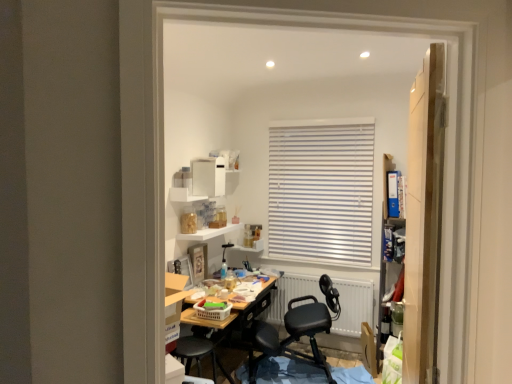
Question: Is white matte radiator at center located outside white matte shelf at upper center, which is counted as the 2th shelf, starting from the top?

Choices:
 (A) yes
 (B) no

Answer: (A)

Question: Is white matte shelf at upper center, marked as the 1th shelf in a bottom-to-top arrangement, a part of white matte radiator at center?

Choices:
 (A) no
 (B) yes

Answer: (A)

Question: Is white matte shelf at upper center, marked as the 1th shelf in a bottom-to-top arrangement, at the back of white matte radiator at center?

Choices:
 (A) yes
 (B) no

Answer: (B)

Question: Can you confirm if white matte radiator at center is smaller than white matte shelf at upper center, which is counted as the 2th shelf, starting from the top?

Choices:
 (A) yes
 (B) no

Answer: (B)

Question: From the image's perspective, would you say white matte radiator at center is positioned over white matte shelf at upper center, which is counted as the 2th shelf, starting from the top?

Choices:
 (A) yes
 (B) no

Answer: (B)

Question: Can you confirm if white matte radiator at center is thinner than white matte shelf at upper center, which is counted as the 2th shelf, starting from the top?

Choices:
 (A) no
 (B) yes

Answer: (B)

Question: Is white glossy shelf at upper center, acting as the second shelf starting from the bottom, smaller than wooden door at right?

Choices:
 (A) no
 (B) yes

Answer: (B)

Question: Is white glossy shelf at upper center, the first shelf positioned from the top, thinner than wooden door at right?

Choices:
 (A) no
 (B) yes

Answer: (B)

Question: Is wooden door at right inside white glossy shelf at upper center, acting as the second shelf starting from the bottom?

Choices:
 (A) yes
 (B) no

Answer: (B)

Question: Is white glossy shelf at upper center, the first shelf positioned from the top, touching wooden door at right?

Choices:
 (A) no
 (B) yes

Answer: (A)

Question: From a real-world perspective, is white glossy shelf at upper center, the first shelf positioned from the top, under wooden door at right?

Choices:
 (A) yes
 (B) no

Answer: (B)

Question: Considering the relative sizes of white glossy shelf at upper center, the first shelf positioned from the top, and wooden door at right in the image provided, is white glossy shelf at upper center, the first shelf positioned from the top, shorter than wooden door at right?

Choices:
 (A) yes
 (B) no

Answer: (A)

Question: From the image's perspective, would you say white matte shelf at upper center, which is counted as the 2th shelf, starting from the top, is positioned over plastic laundry basket at center?

Choices:
 (A) yes
 (B) no

Answer: (A)